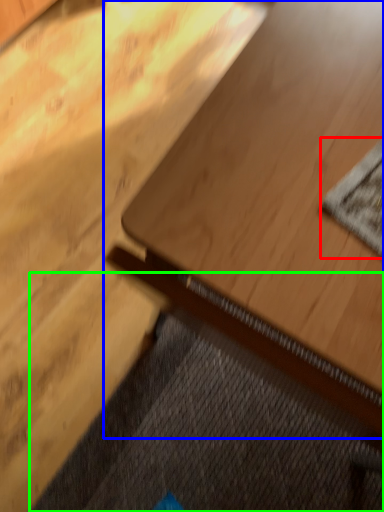
Question: Estimate the real-world distances between objects in this image. Which object is closer to mat (highlighted by a red box), table (highlighted by a blue box) or doormat (highlighted by a green box)?

Choices:
 (A) table
 (B) doormat

Answer: (A)